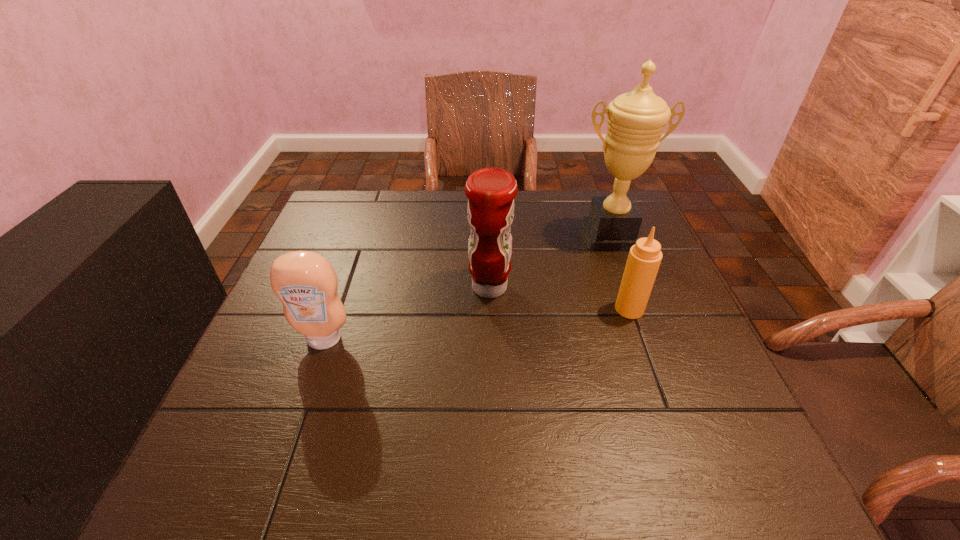
The width and height of the screenshot is (960, 540). I want to click on vacant space at the far left corner of the desktop, so click(x=368, y=213).

This screenshot has height=540, width=960. Find the location of `vacant space at the near right corner of the desktop`. vacant space at the near right corner of the desktop is located at coordinates (732, 492).

Find the location of `empty space between the rightmost condiment and the tallest condiment`. empty space between the rightmost condiment and the tallest condiment is located at coordinates (560, 298).

Identify the location of vacant area between the trophy cup and the second tallest object. (549, 262).

You are a GUI agent. You are given a task and a screenshot of the screen. Output one action in this format:
    pyautogui.click(x=<x>, y=<y>)
    Task: Click on the empty space that is in between the third shortest object and the rightmost condiment
    
    Given the screenshot: What is the action you would take?
    pyautogui.click(x=560, y=298)

The height and width of the screenshot is (540, 960). Find the location of `blank region between the trophy cup and the rightmost condiment`. blank region between the trophy cup and the rightmost condiment is located at coordinates (619, 273).

This screenshot has width=960, height=540. I want to click on free area in between the third shortest object and the trophy cup, so coord(549,262).

The image size is (960, 540). I want to click on free space between the nearest object and the rightmost condiment, so click(476, 324).

Where is `vacant area between the rightmost condiment and the tallest condiment`? vacant area between the rightmost condiment and the tallest condiment is located at coordinates (560, 298).

Locate an element on the screen. The image size is (960, 540). free space that is in between the farthest object and the tallest condiment is located at coordinates (549, 262).